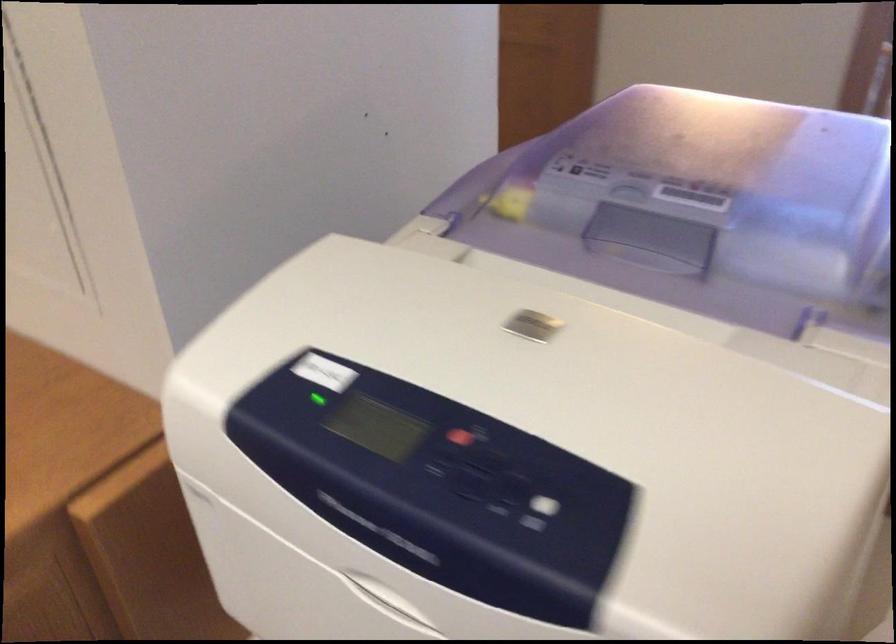
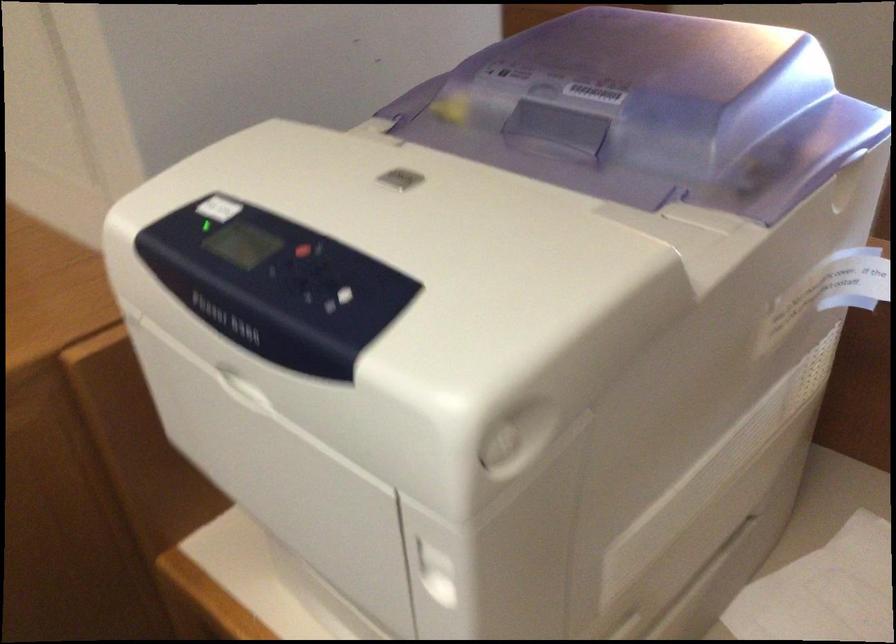
Question: The first image is from the beginning of the video and the second image is from the end. How did the camera likely rotate when shooting the video?

Choices:
 (A) Left
 (B) Right
 (C) Up
 (D) Down

Answer: (A)